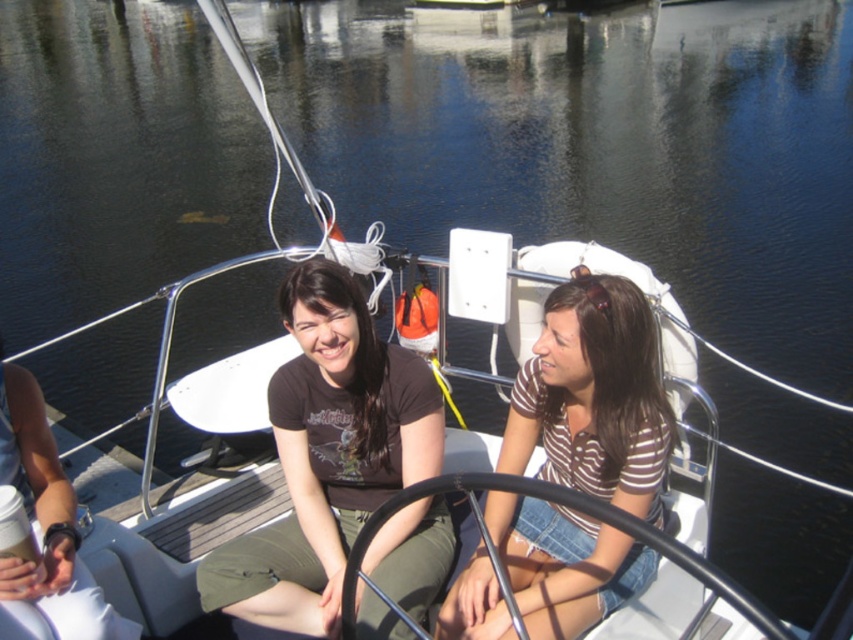
You are a passenger on the sailboat and want to hand a drink to both the matte black shirt at center and the brown striped shirt at center. Which person should you approach first based on their position relative to you?

You should approach the matte black shirt at center first because they are closer to you than the brown striped shirt at center, who is further away.

You are a photographer on the sailboat and want to capture both the matte black shirt at center and the brown striped shirt at center in a single photo. Which person should you position closer to the camera to ensure both are fully visible?

Since the matte black shirt at center is much taller than the brown striped shirt at center, you should position the brown striped shirt at center closer to the camera to ensure both are fully visible in the photo.